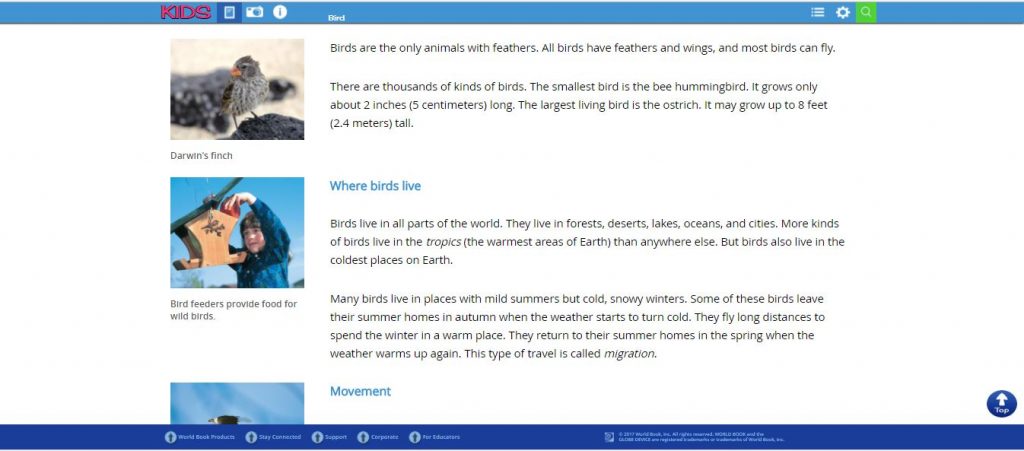
Locate an element on the screen. This screenshot has height=451, width=1024. wall is located at coordinates click(261, 397).